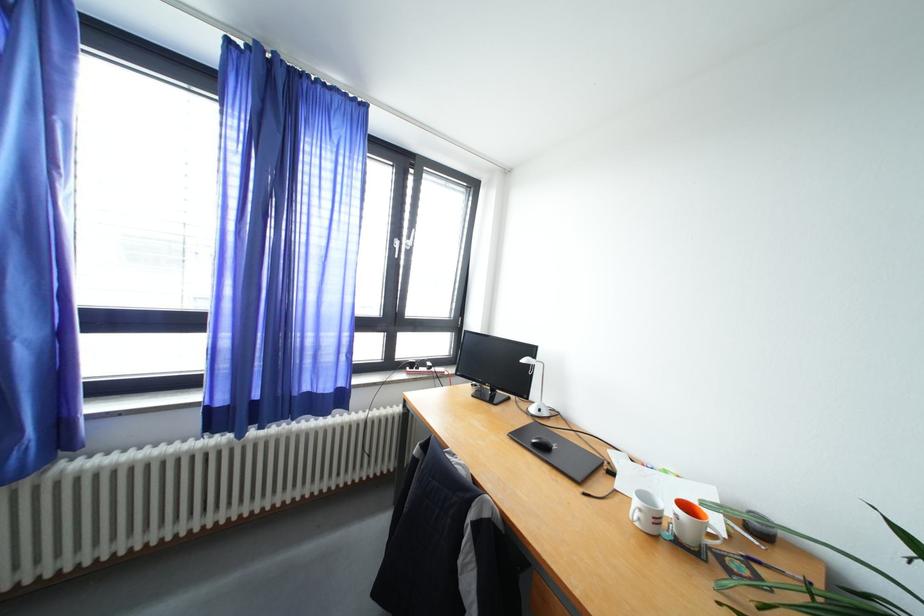
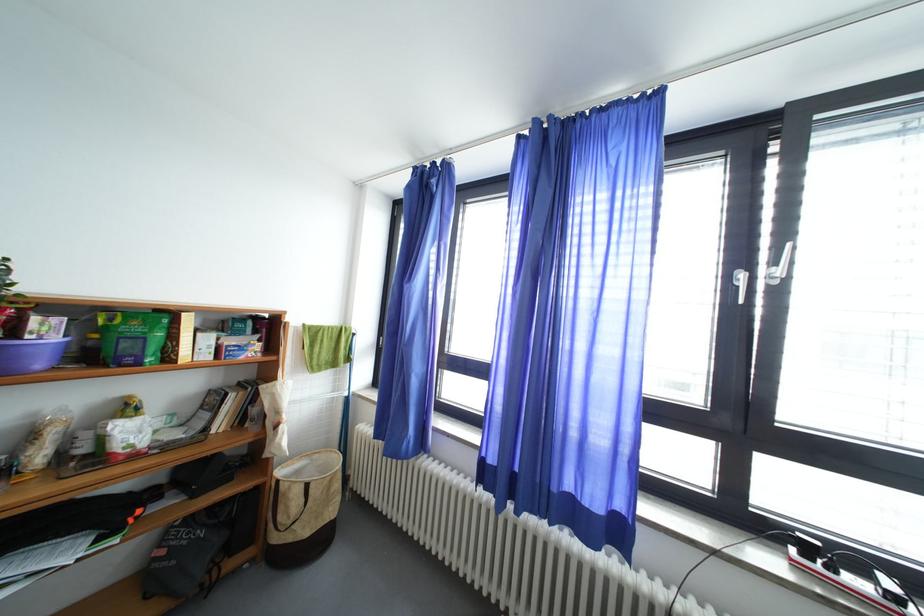
Question: How did the camera likely rotate?

Choices:
 (A) Left
 (B) Right
 (C) Up
 (D) Down

Answer: (A)